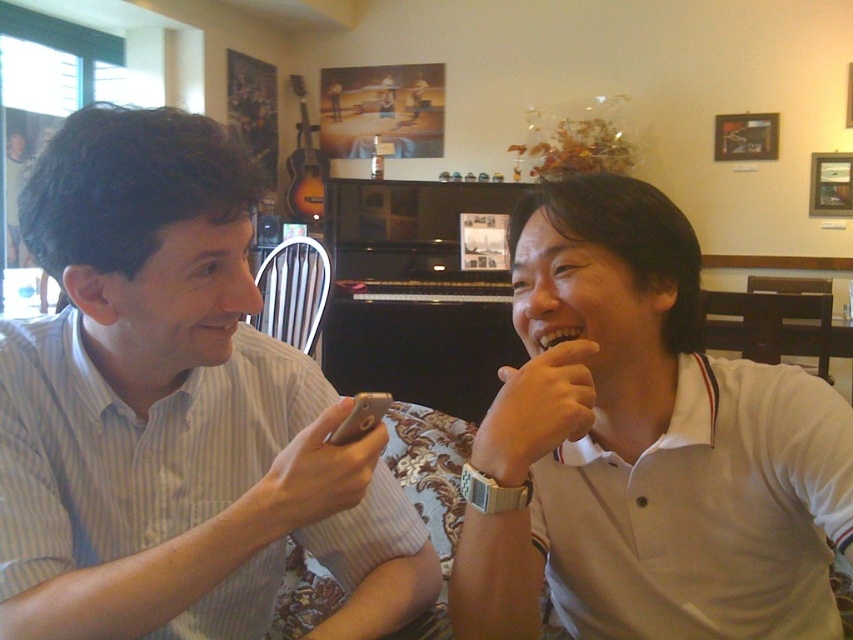
Is light brown striped shirt at center positioned at the back of white cotton shirt at right?

No, it is in front of white cotton shirt at right.

Is light brown striped shirt at center positioned before white cotton shirt at right?

Yes, light brown striped shirt at center is closer to the viewer.

Image resolution: width=853 pixels, height=640 pixels. Describe the element at coordinates (173, 412) in the screenshot. I see `light brown striped shirt at center` at that location.

The image size is (853, 640). Find the location of `light brown striped shirt at center`. light brown striped shirt at center is located at coordinates (173, 412).